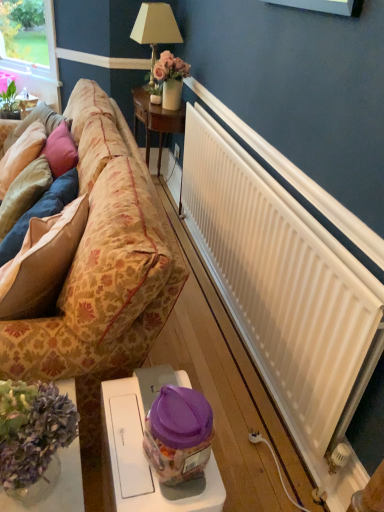
Question: In terms of width, does suede-like beige pillow at left, the 3th pillow positioned from the left, look wider or thinner when compared to floral-patterned fabric couch at left?

Choices:
 (A) wide
 (B) thin

Answer: (B)

Question: Would you say suede-like beige pillow at left, the 3th pillow positioned from the left, is to the left or to the right of floral-patterned fabric couch at left in the picture?

Choices:
 (A) right
 (B) left

Answer: (A)

Question: Estimate the real-world distances between objects in this image. Which object is farther from the translucent plastic jar at lower center?

Choices:
 (A) white matte radiator at right
 (B) floral-patterned fabric couch at left
 (C) woodenmaterial/texturetable at upper center, the 3th table in the bottom-to-top sequence
 (D) suede-like beige pillow at left, the 3th pillow positioned from the left
 (E) velvet floral pillow at left, the 2th pillow from the right

Answer: (C)

Question: Estimate the real-world distances between objects in this image. Which object is closer to the suede-like beige pillow at left, the 3th pillow positioned from the left?

Choices:
 (A) woodenmaterial/texturetable at upper center, the 3th table in the bottom-to-top sequence
 (B) white plastic table at lower center, marked as the first table in a front-to-back arrangement
 (C) velvet floral pillow at left, positioned as the 2th pillow in left-to-right order
 (D) white matte radiator at right
 (E) floral-patterned fabric couch at left

Answer: (E)